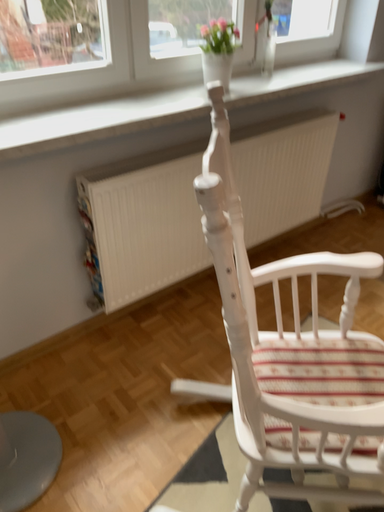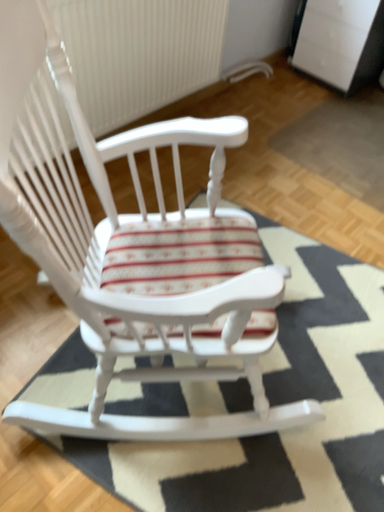
Question: How did the camera likely rotate when shooting the video?

Choices:
 (A) rotated left
 (B) rotated right

Answer: (B)